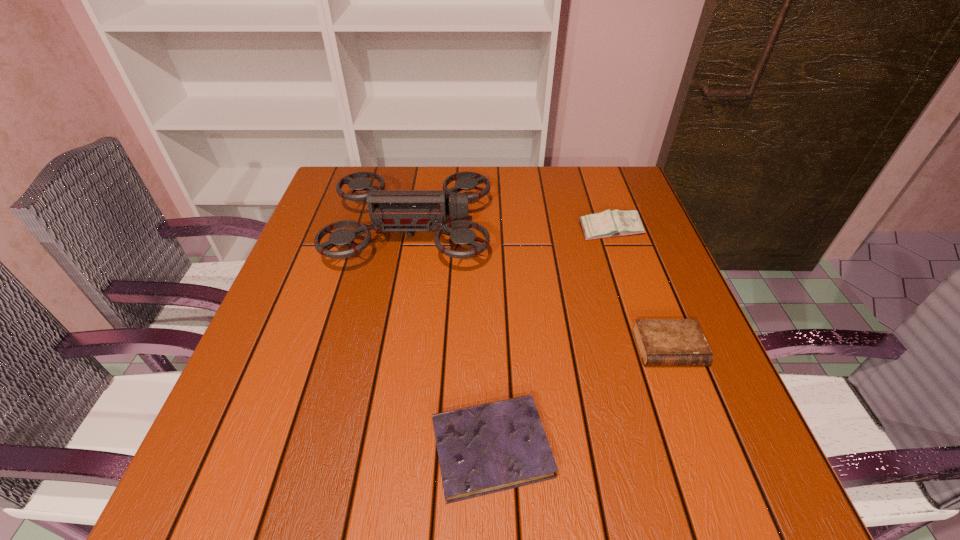
At what (x,y) coordinates should I click in order to perform the action: click on vacant area that lies between the third tallest object and the tallest diary. Please return your answer as a coordinate pair (x, y). The width and height of the screenshot is (960, 540). Looking at the image, I should click on (639, 289).

Locate an element on the screen. This screenshot has height=540, width=960. the closest object to the nearest diary is located at coordinates (661, 342).

Identify the location of the closest object to the tallest object. (616, 223).

I want to click on diary that is the second closest one to the tallest object, so click(x=487, y=448).

At what (x,y) coordinates should I click in order to perform the action: click on diary that is the closest to the second tallest diary. Please return your answer as a coordinate pair (x, y). Image resolution: width=960 pixels, height=540 pixels. Looking at the image, I should click on (487, 448).

The width and height of the screenshot is (960, 540). In order to click on vacant position in the image that satisfies the following two spatial constraints: 1. on the front-facing side of the drone; 2. on the right side of the nearest diary in this screenshot , I will do `click(372, 448)`.